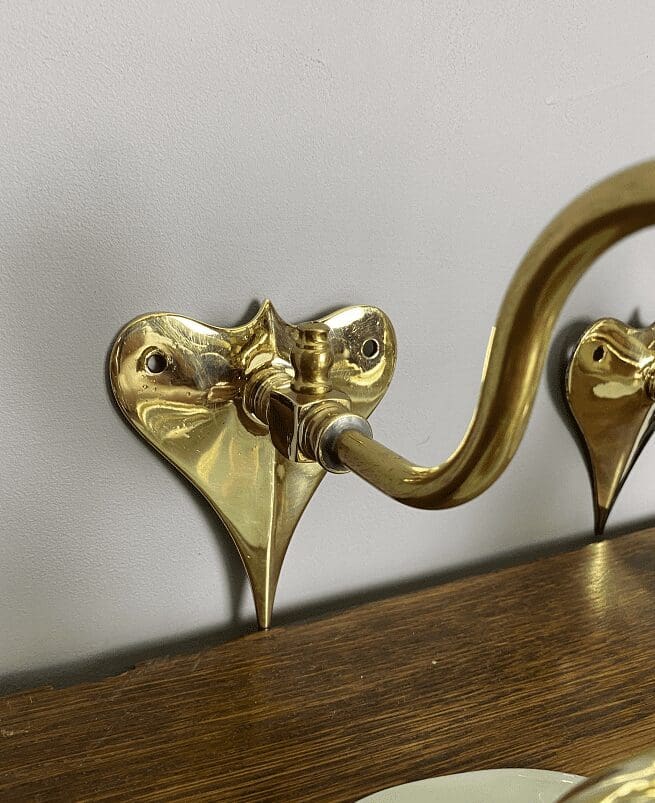
You are a GUI agent. You are given a task and a screenshot of the screen. Output one action in this format:
    pyautogui.click(x=<x>, y=<y>)
    Task: Click on the wall
    The height and width of the screenshot is (803, 655).
    Given the screenshot: What is the action you would take?
    pyautogui.click(x=255, y=202)